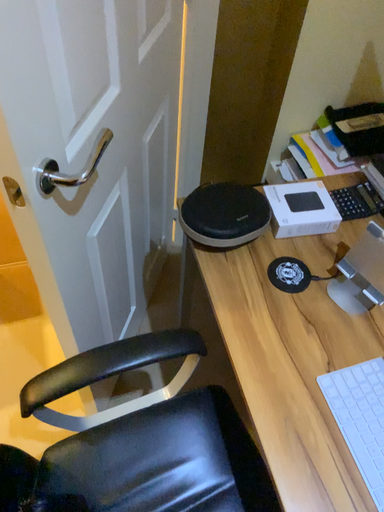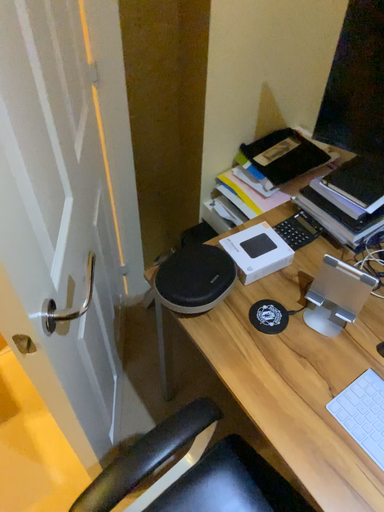
Question: How did the camera likely rotate when shooting the video?

Choices:
 (A) rotated left
 (B) rotated right

Answer: (B)